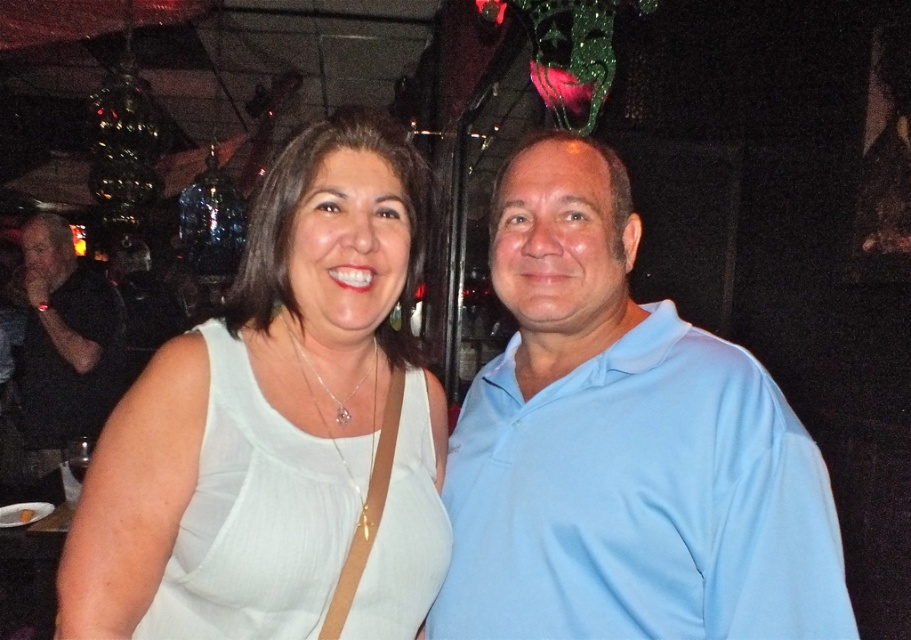
Question: Can you confirm if light blue cotton shirt at center is positioned to the left of white fabric dress at center?

Choices:
 (A) yes
 (B) no

Answer: (B)

Question: Is white fabric dress at center to the left of black shirt at left from the viewer's perspective?

Choices:
 (A) no
 (B) yes

Answer: (A)

Question: Which object is closer to the camera taking this photo?

Choices:
 (A) light blue cotton shirt at center
 (B) black shirt at left
 (C) white fabric dress at center

Answer: (A)

Question: Which point is closer to the camera?

Choices:
 (A) (411, 435)
 (B) (37, 316)
 (C) (604, 544)

Answer: (C)

Question: Which of these objects is positioned closest to the black shirt at left?

Choices:
 (A) light blue cotton shirt at center
 (B) white fabric dress at center

Answer: (B)

Question: Can you confirm if light blue cotton shirt at center is wider than white fabric dress at center?

Choices:
 (A) no
 (B) yes

Answer: (B)